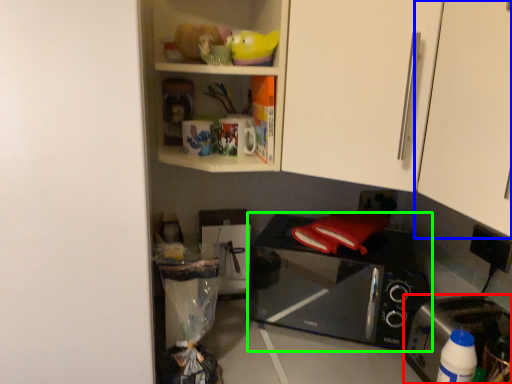
Question: Which object is the closest to the toaster (highlighted by a red box)? Choose among these: cabinetry (highlighted by a blue box) or microwave oven (highlighted by a green box).

Choices:
 (A) cabinetry
 (B) microwave oven

Answer: (B)